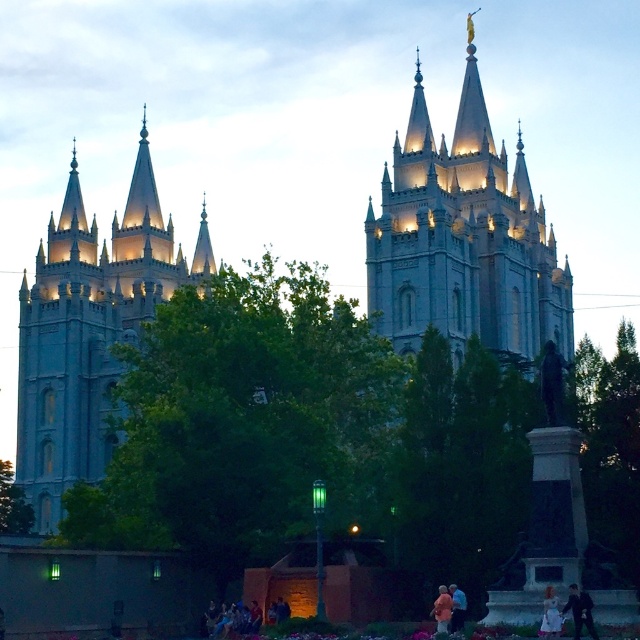
Question: Which of the following is the closest to the observer?

Choices:
 (A) light blue fabric at lower center
 (B) orange fabric coat at lower center
 (C) dark blue suit at lower right

Answer: (C)

Question: Based on their relative distances, which object is farther from the orange fabric coat at lower center?

Choices:
 (A) light gray stone tower at left
 (B) light brown hair at lower right

Answer: (A)

Question: Which point is farther to the camera?

Choices:
 (A) orange fabric coat at lower center
 (B) light gray stone tower at left

Answer: (B)

Question: Does light gray stone tower at left appear on the right side of orange fabric coat at lower center?

Choices:
 (A) yes
 (B) no

Answer: (B)

Question: Is light gray stone tower at left positioned in front of dark blue suit at lower right?

Choices:
 (A) yes
 (B) no

Answer: (B)

Question: Is light brown hair at lower right positioned at the back of orange fabric coat at lower center?

Choices:
 (A) yes
 (B) no

Answer: (B)